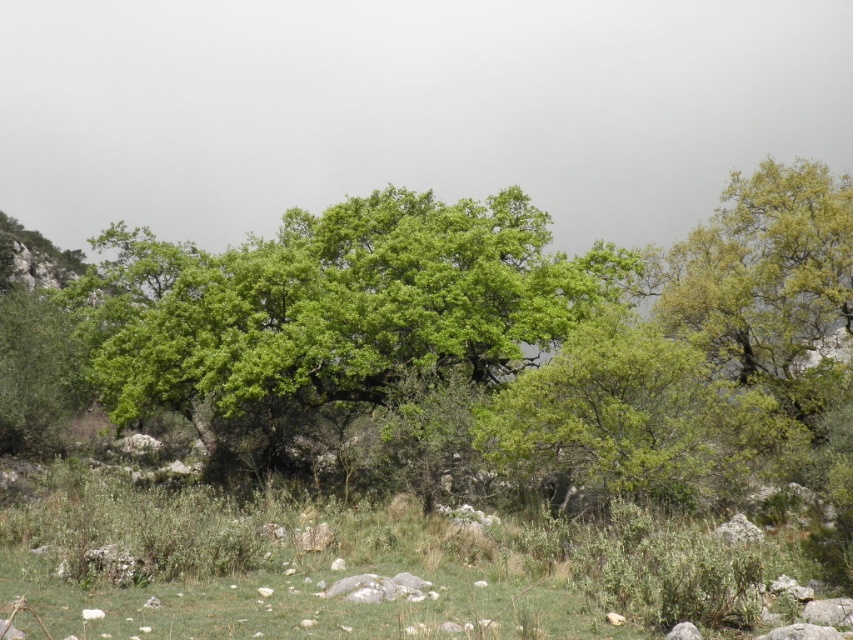
You are planning to set up a small tent in the area shown in the image. Considering the space available between the green grass at center and the green leafy tree at center, will the tent, which requires a minimum of 2 meters of space, fit comfortably?

The green grass at center has a width less than the green leafy tree at center. However, the exact dimensions are not provided, so it is uncertain whether the space between them is sufficient for a 2 meter tent. Further measurement is needed.

You are standing at the point marked by the coordinates (381, 570) in the image. Looking around, you notice the green grass at center. Which direction should you face to see the dense cluster of green trees mentioned in the scene description?

The dense cluster of green trees is located in the direction opposite to the green grass at center, so you should face away from the green grass at center to see the dense cluster of green trees.

You are standing in the middle of the dense green trees and want to walk towards the point labeled as point (126,548). Which direction should you go relative to the point labeled as point (312,326)?

Since point (126,548) is closer to the camera than point (312,326), you should walk towards the direction of point (126,548) which is closer to you compared to point (312,326).